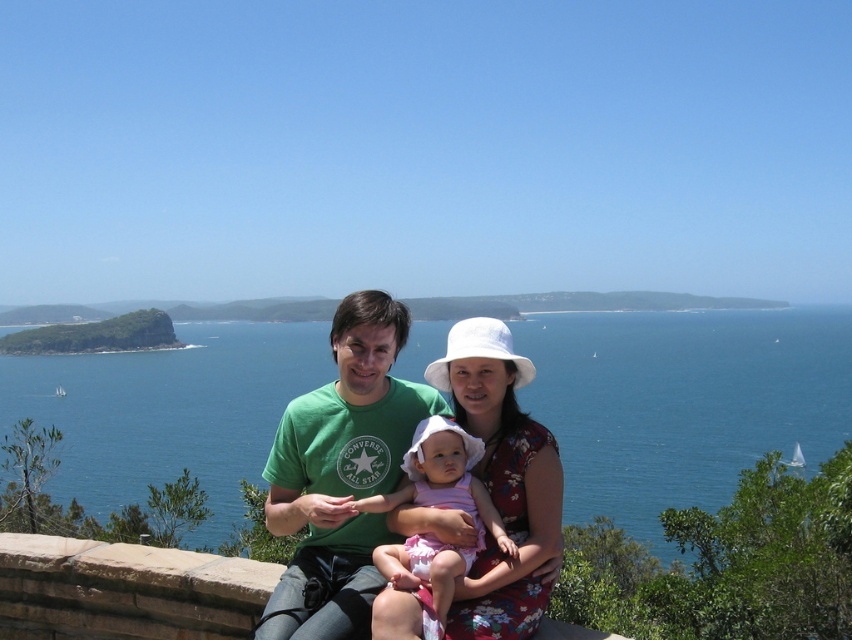
You are standing in front of the coastal scene and want to determine which point is closer to you. The points are point 1 at coordinates (665, 426) and point 2 at coordinates (389, 424). Which point is closer to you?

Point 1 at coordinates (665, 426) is closer to you because it is further to the viewer than point 2 at coordinates (389, 424).